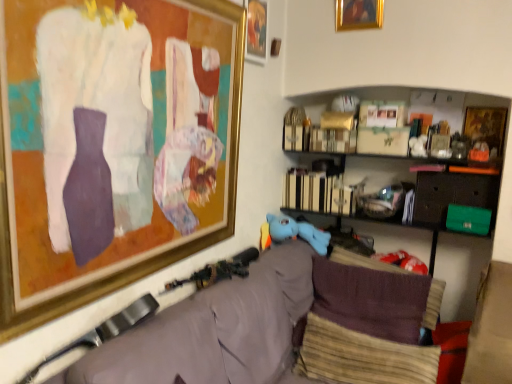
What do you see at coordinates (298, 232) in the screenshot? I see `blue plush toy at center` at bounding box center [298, 232].

What do you see at coordinates (256, 31) in the screenshot? The height and width of the screenshot is (384, 512). I see `gold-framed picture at upper center, the second picture frame when ordered from left to right` at bounding box center [256, 31].

Describe the element at coordinates (490, 329) in the screenshot. I see `matte brown cushion at lower right` at that location.

You are a GUI agent. You are given a task and a screenshot of the screen. Output one action in this format:
    pyautogui.click(x=<x>, y=<y>)
    Task: Click on the matte brown cushion at lower right
    The image size is (512, 384).
    Given the screenshot: What is the action you would take?
    click(x=490, y=329)

How much space does woolen fabric pillow at center, which ranks as the 2th pillow in front-to-back order, occupy vertically?

The height of woolen fabric pillow at center, which ranks as the 2th pillow in front-to-back order, is 13.22 inches.

Locate an element on the screen. Image resolution: width=512 pixels, height=384 pixels. gold-framed painting at upper center, which is the 3th picture frame in left-to-right order is located at coordinates (358, 14).

Does point (147, 325) appear closer or farther from the camera than point (314, 249)?

Point (147, 325).

Looking at the image, does velvet grey couch at lower center seem bigger or smaller compared to blue plush toy at center?

In the image, velvet grey couch at lower center appears to be larger than blue plush toy at center.

Is woolen fabric pillow at center, which ranks as the 2th pillow in front-to-back order, in contact with gold-framed painting at upper left, the fourth picture frame viewed from the right?

woolen fabric pillow at center, which ranks as the 2th pillow in front-to-back order, and gold-framed painting at upper left, the fourth picture frame viewed from the right, are clearly separated.

Is gold-framed painting at upper left, the fourth picture frame viewed from the right, completely or partially inside woolen fabric pillow at center, the 1th pillow when ordered from back to front?

No.

Would you say woolen fabric pillow at center, the 1th pillow when ordered from back to front, is to the left or to the right of gold-framed painting at upper left, the fourth picture frame viewed from the right, in the picture?

Based on their positions, woolen fabric pillow at center, the 1th pillow when ordered from back to front, is located to the right of gold-framed painting at upper left, the fourth picture frame viewed from the right.

From a real-world perspective, is velvet grey couch at lower center beneath gold-framed painting at upper left, the fourth picture frame viewed from the right?

Yes, from a real-world perspective, velvet grey couch at lower center is beneath gold-framed painting at upper left, the fourth picture frame viewed from the right.

What's the angular difference between velvet grey couch at lower center and gold-framed painting at upper left, which is the first picture frame in left-to-right order,'s facing directions?

There is a 0.43-degree angle between the facing directions of velvet grey couch at lower center and gold-framed painting at upper left, which is the first picture frame in left-to-right order.

Do you think velvet grey couch at lower center is within gold-framed painting at upper left, the fourth picture frame viewed from the right, or outside of it?

velvet grey couch at lower center is not inside gold-framed painting at upper left, the fourth picture frame viewed from the right, it's outside.

How distant is velvet grey couch at lower center from gold-framed painting at upper left, which is the first picture frame in left-to-right order?

23.57 inches.

Can you tell me how much gold-framed picture at upper center, the second picture frame when ordered from left to right, and velvet grey couch at lower center differ in facing direction?

2.14 degrees.

Is gold-framed picture at upper center, which ranks as the third picture frame in right-to-left order, oriented away from velvet grey couch at lower center?

gold-framed picture at upper center, which ranks as the third picture frame in right-to-left order, does not have its back to velvet grey couch at lower center.

Is gold-framed picture at upper center, the second picture frame when ordered from left to right, in contact with velvet grey couch at lower center?

No, gold-framed picture at upper center, the second picture frame when ordered from left to right, is not in contact with velvet grey couch at lower center.

Considering the positions of objects gold-framed picture at upper center, the second picture frame when ordered from left to right, and velvet grey couch at lower center in the image provided, who is more to the left, gold-framed picture at upper center, the second picture frame when ordered from left to right, or velvet grey couch at lower center?

From the viewer's perspective, gold-framed picture at upper center, the second picture frame when ordered from left to right, appears more on the left side.

Which point is more distant from viewer, (x=499, y=109) or (x=226, y=326)?

The point (x=499, y=109) is behind.

Does wooden framed picture at upper right, the first picture frame from the right, lie behind velvet grey couch at lower center?

Yes, it is.

Which of these two, wooden framed picture at upper right, the fourth picture frame viewed from the left, or velvet grey couch at lower center, is smaller?

With smaller size is wooden framed picture at upper right, the fourth picture frame viewed from the left.

How many degrees apart are the facing directions of wooden framed picture at upper right, the fourth picture frame viewed from the left, and velvet grey couch at lower center?

wooden framed picture at upper right, the fourth picture frame viewed from the left, and velvet grey couch at lower center are facing 91.2 degrees away from each other.

Would you say blue plush toy at center contains woolen fabric pillow at center, which ranks as the 2th pillow in front-to-back order?

No.

Where is `the 1st pillow directly beneath the blue plush toy at center (from a real-world perspective)`? The image size is (512, 384). the 1st pillow directly beneath the blue plush toy at center (from a real-world perspective) is located at coordinates (371, 300).

Is blue plush toy at center touching woolen fabric pillow at center, the 1th pillow when ordered from back to front?

They are not placed beside each other.

In terms of height, does blue plush toy at center look taller or shorter compared to woolen fabric pillow at center, the 1th pillow when ordered from back to front?

In the image, blue plush toy at center appears to be shorter than woolen fabric pillow at center, the 1th pillow when ordered from back to front.

From the image's perspective, count 1st pillows downward from the blue plush toy at center and point to it. Please provide its 2D coordinates.

[(371, 300)]

From a real-world perspective, which object rests below the other?

woolen fabric pillow at center, the 1th pillow when ordered from back to front.

Is woolen fabric pillow at center, which ranks as the 2th pillow in front-to-back order, in front of or behind blue plush toy at center in the image?

Clearly, woolen fabric pillow at center, which ranks as the 2th pillow in front-to-back order, is in front of blue plush toy at center.

You are a GUI agent. You are given a task and a screenshot of the screen. Output one action in this format:
    pyautogui.click(x=<x>, y=<y>)
    Task: Click on the toy that appears on the right of velvet grey couch at lower center
    
    Given the screenshot: What is the action you would take?
    [298, 232]

Locate an element on the screen. The width and height of the screenshot is (512, 384). picture frame that is the 3rd one when counting leftward from the woolen fabric pillow at center, which ranks as the 2th pillow in front-to-back order is located at coordinates (112, 145).

When comparing their distances from beige textured pillow at lower right, placed as the first pillow when sorted from front to back, does velvet grey couch at lower center or matte brown cushion at lower right seem closer?

Based on the image, velvet grey couch at lower center appears to be nearer to beige textured pillow at lower right, placed as the first pillow when sorted from front to back.

Based on their spatial positions, is matte brown cushion at lower right or woolen fabric pillow at center, which ranks as the 2th pillow in front-to-back order, further from gold-framed painting at upper left, the fourth picture frame viewed from the right?

matte brown cushion at lower right.

Based on the photo, from the image, which object appears to be farther from beige textured pillow at lower right, placed as the first pillow when sorted from front to back, gold-framed picture at upper center, the second picture frame when ordered from left to right, or blue plush toy at center?

Based on the image, gold-framed picture at upper center, the second picture frame when ordered from left to right, appears to be further to beige textured pillow at lower right, placed as the first pillow when sorted from front to back.

Considering their positions, is gold-framed painting at upper left, which is the first picture frame in left-to-right order, positioned further to blue plush toy at center than velvet grey couch at lower center?

Among the two, gold-framed painting at upper left, which is the first picture frame in left-to-right order, is located further to blue plush toy at center.

When comparing their distances from gold-framed painting at upper center, which is the 3th picture frame in left-to-right order, does matte brown cushion at lower right or gold-framed painting at upper left, the fourth picture frame viewed from the right, seem closer?

gold-framed painting at upper left, the fourth picture frame viewed from the right, lies closer to gold-framed painting at upper center, which is the 3th picture frame in left-to-right order, than the other object.

From the image, which object appears to be nearer to gold-framed picture at upper center, the second picture frame when ordered from left to right, gold-framed painting at upper left, the fourth picture frame viewed from the right, or woolen fabric pillow at center, the 1th pillow when ordered from back to front?

gold-framed painting at upper left, the fourth picture frame viewed from the right, lies closer to gold-framed picture at upper center, the second picture frame when ordered from left to right, than the other object.

Estimate the real-world distances between objects in this image. Which object is closer to gold-framed painting at upper left, the fourth picture frame viewed from the right, gold-framed painting at upper center, the second picture frame viewed from the right, or blue plush toy at center?

blue plush toy at center is positioned closer to the anchor gold-framed painting at upper left, the fourth picture frame viewed from the right.

From the picture: Looking at the image, which one is located closer to gold-framed painting at upper left, which is the first picture frame in left-to-right order, wooden framed picture at upper right, the first picture frame from the right, or matte brown cushion at lower right?

matte brown cushion at lower right is positioned closer to the anchor gold-framed painting at upper left, which is the first picture frame in left-to-right order.

Locate an element on the screen. This screenshot has width=512, height=384. couch located between gold-framed painting at upper left, which is the first picture frame in left-to-right order, and matte brown cushion at lower right in the left-right direction is located at coordinates (214, 331).

I want to click on furniture located between gold-framed painting at upper left, the fourth picture frame viewed from the right, and blue plush toy at center in the depth direction, so (x=490, y=329).

Identify the location of toy between gold-framed picture at upper center, the second picture frame when ordered from left to right, and beige textured pillow at lower right, the 2th pillow positioned from the back, in the vertical direction. (298, 232).

The width and height of the screenshot is (512, 384). I want to click on toy between gold-framed painting at upper center, the second picture frame viewed from the right, and velvet grey couch at lower center vertically, so click(x=298, y=232).